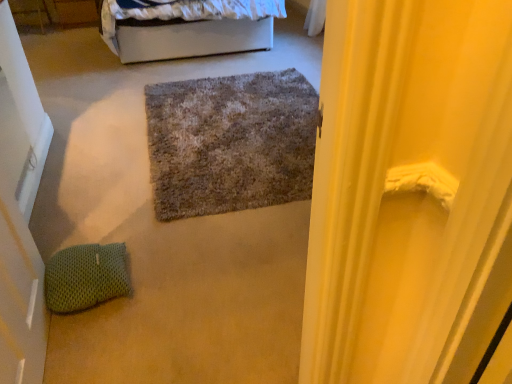
Question: From a real-world perspective, is white fabric bed at upper center physically located above or below wooden drawer at upper left?

Choices:
 (A) below
 (B) above

Answer: (B)

Question: Considering the positions of white fabric bed at upper center and wooden drawer at upper left in the image, is white fabric bed at upper center wider or thinner than wooden drawer at upper left?

Choices:
 (A) wide
 (B) thin

Answer: (A)

Question: Which of these objects is positioned farthest from the textured gray rug at center?

Choices:
 (A) white matte door at left
 (B) green knitted pillow at lower left
 (C) wooden drawer at upper left
 (D) white fabric bed at upper center

Answer: (C)

Question: Considering the real-world distances, which object is closest to the textured gray rug at center?

Choices:
 (A) white fabric bed at upper center
 (B) green knitted pillow at lower left
 (C) white matte door at left
 (D) wooden drawer at upper left

Answer: (B)